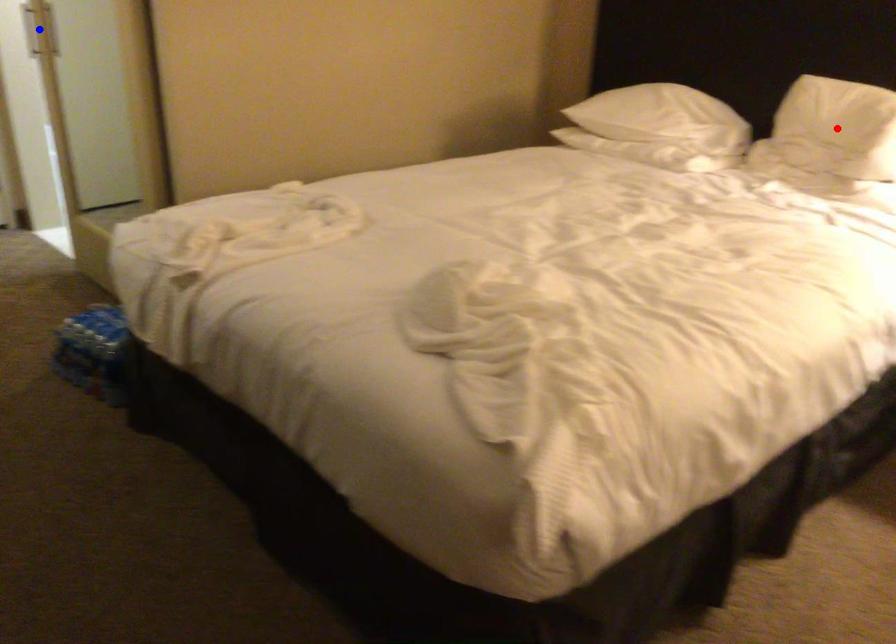
Question: In the image, two points are highlighted. Which point is nearer to the camera? Reply with the corresponding letter.

Choices:
 (A) blue point
 (B) red point

Answer: (B)